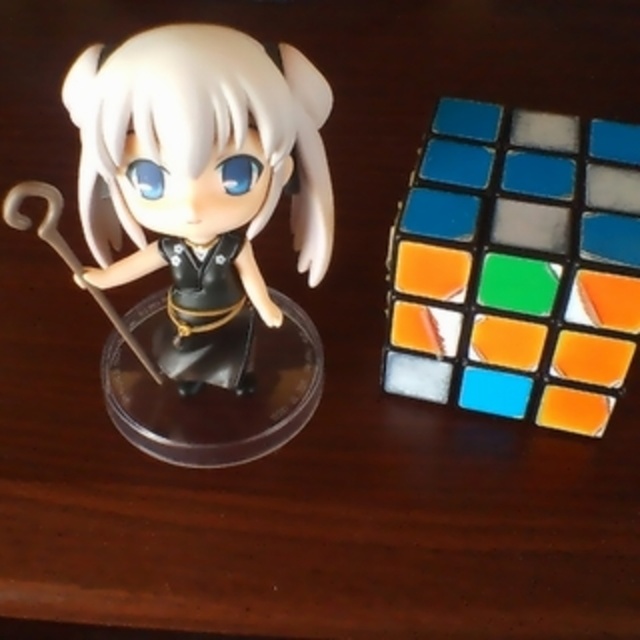
Question: Does satin black figurine at left appear on the right side of matte gray cube at center right?

Choices:
 (A) yes
 (B) no

Answer: (B)

Question: Is rubberized plastic rubik's cube at right to the right of satin black figurine at left from the viewer's perspective?

Choices:
 (A) yes
 (B) no

Answer: (A)

Question: Is rubberized plastic rubik's cube at right above satin black figurine at left?

Choices:
 (A) yes
 (B) no

Answer: (B)

Question: Estimate the real-world distances between objects in this image. Which object is closer to the rubberized plastic rubik's cube at right?

Choices:
 (A) matte gray cube at center right
 (B) satin black figurine at left

Answer: (A)

Question: Which of the following is the farthest from the observer?

Choices:
 (A) (518, 408)
 (B) (564, 232)

Answer: (A)

Question: Which point appears closest to the camera in this image?

Choices:
 (A) (214, 284)
 (B) (564, 220)
 (C) (499, 268)

Answer: (C)